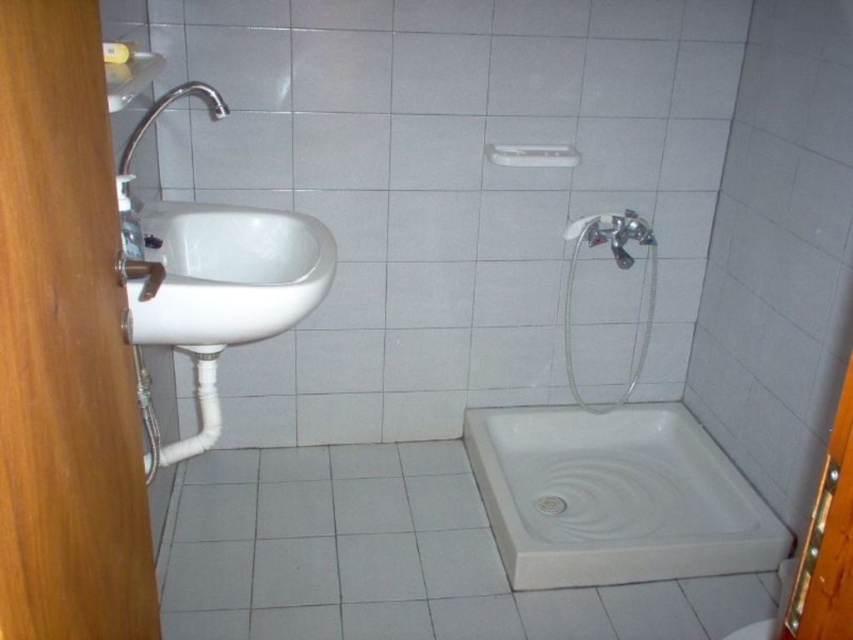
Question: Can you confirm if white smooth bathtub at lower center is thinner than white ceramic drain at lower center?

Choices:
 (A) no
 (B) yes

Answer: (A)

Question: Among these points, which one is farthest from the camera?

Choices:
 (A) (158, 296)
 (B) (212, 108)
 (C) (572, 264)

Answer: (C)

Question: Can you confirm if white smooth bathtub at lower center is positioned to the right of matte silver faucet at upper left?

Choices:
 (A) yes
 (B) no

Answer: (A)

Question: Which point is closer to the camera?

Choices:
 (A) white ceramic drain at lower center
 (B) white smooth bathtub at lower center

Answer: (B)

Question: Where is matte silver shower head at upper right located in relation to white ceramic drain at lower center in the image?

Choices:
 (A) below
 (B) above

Answer: (B)

Question: Estimate the real-world distances between objects in this image. Which object is closer to the white glossy sink at left?

Choices:
 (A) white ceramic drain at lower center
 (B) matte silver shower head at upper right

Answer: (B)